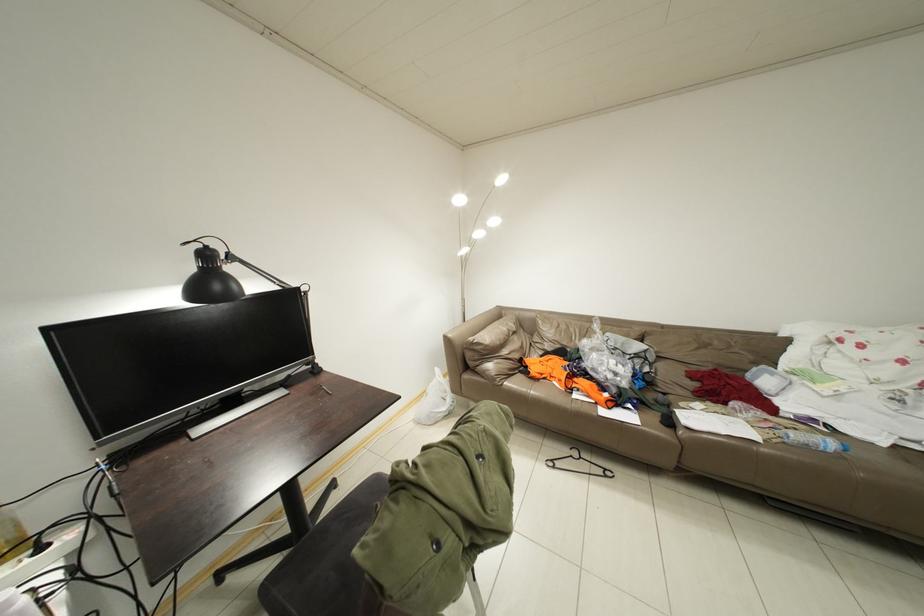
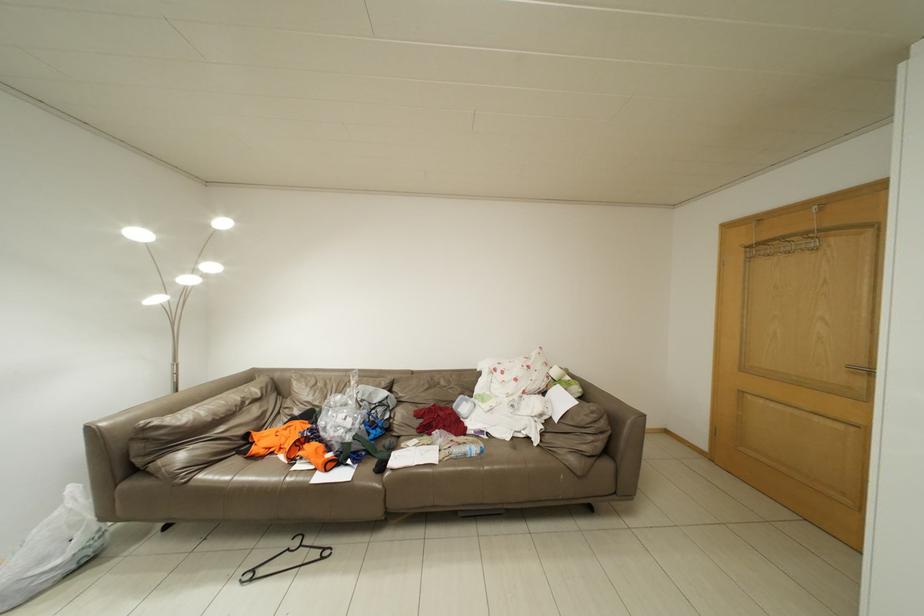
Question: The camera is either moving clockwise (left) or counter-clockwise (right) around the object. The first image is from the beginning of the video and the second image is from the end. Is the camera moving left or right when shooting the video?

Choices:
 (A) Left
 (B) Right

Answer: (A)